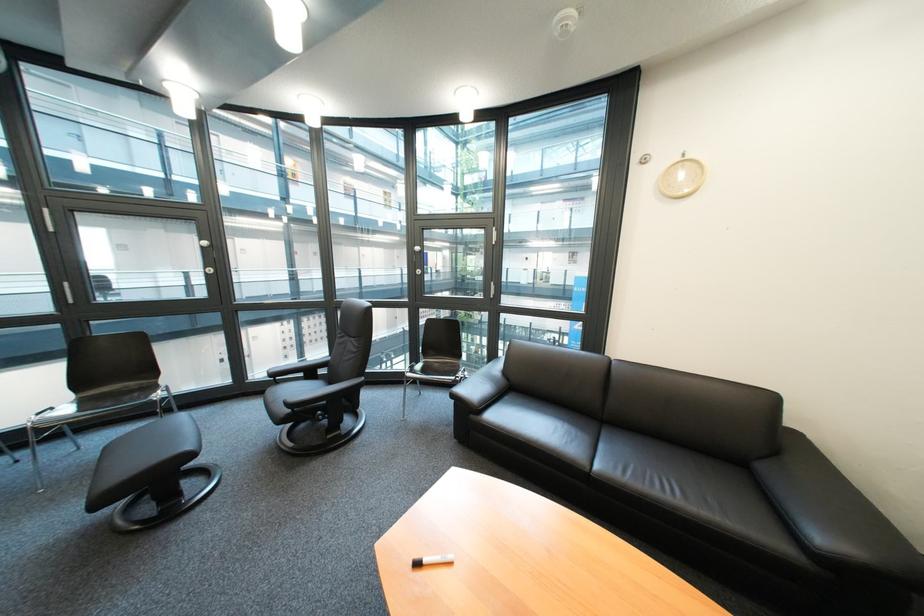
Identify the location of sofa armrest. The height and width of the screenshot is (616, 924). (822, 504).